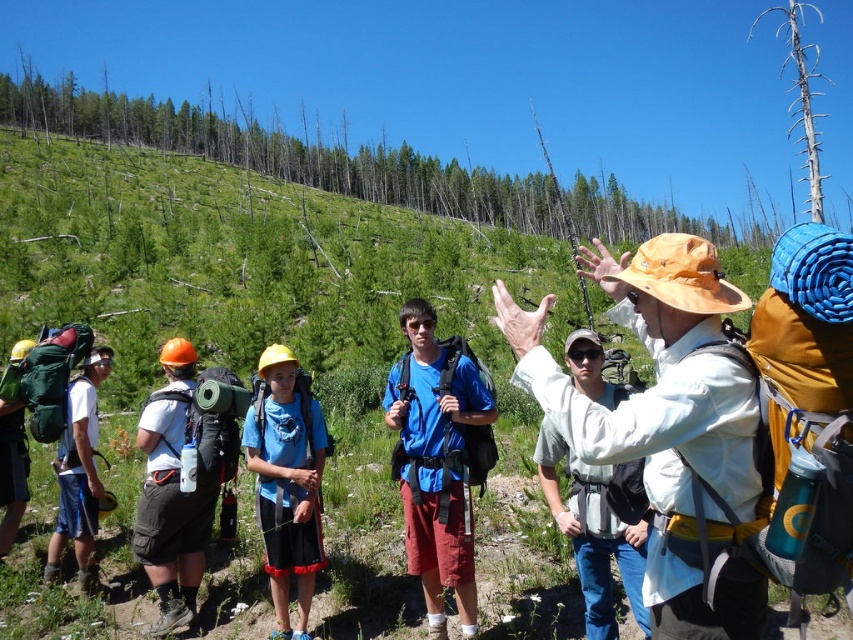
Is blue matte shirt at center taller than matte green backpack at left?

Yes.

Is blue matte shirt at center shorter than matte green backpack at left?

No, blue matte shirt at center is not shorter than matte green backpack at left.

Is point (415, 509) less distant than point (90, 461)?

Yes, point (415, 509) is in front of point (90, 461).

At what (x,y) coordinates should I click in order to perform the action: click on blue matte shirt at center. Please return your answer as a coordinate pair (x, y). This screenshot has width=853, height=640. Looking at the image, I should click on (434, 461).

Is blue matte shirt at center bigger than brushed metal backpack at left?

Correct, blue matte shirt at center is larger in size than brushed metal backpack at left.

Can you confirm if blue matte shirt at center is wider than brushed metal backpack at left?

Yes.

Locate an element on the screen. The width and height of the screenshot is (853, 640). blue matte shirt at center is located at coordinates 434,461.

Is point (692, 291) positioned behind point (144, 403)?

No, it is not.

You are a GUI agent. You are given a task and a screenshot of the screen. Output one action in this format:
    pyautogui.click(x=<x>, y=<y>)
    Task: Click on the white matte jacket at center
    
    Given the screenshot: What is the action you would take?
    pyautogui.click(x=656, y=376)